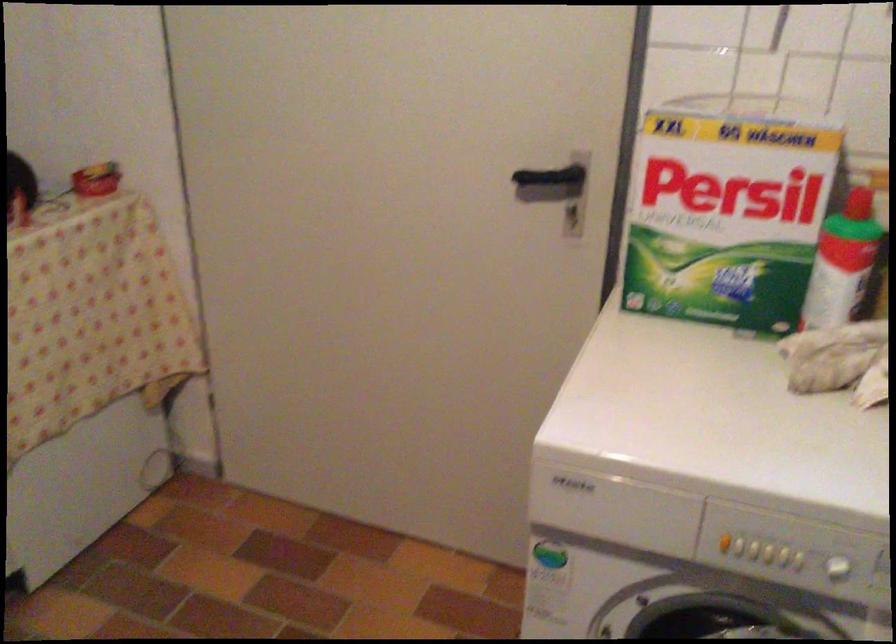
You are a GUI agent. You are given a task and a screenshot of the screen. Output one action in this format:
    pyautogui.click(x=<x>, y=<y>)
    Task: Click on the black door handle
    The image size is (896, 644).
    Given the screenshot: What is the action you would take?
    [553, 180]